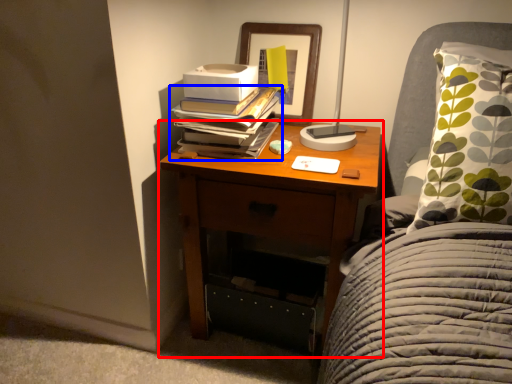
Question: Which of the following is the closest to the observer, nightstand (highlighted by a red box) or book (highlighted by a blue box)?

Choices:
 (A) nightstand
 (B) book

Answer: (A)